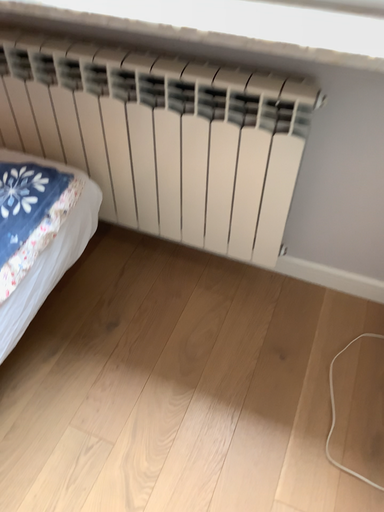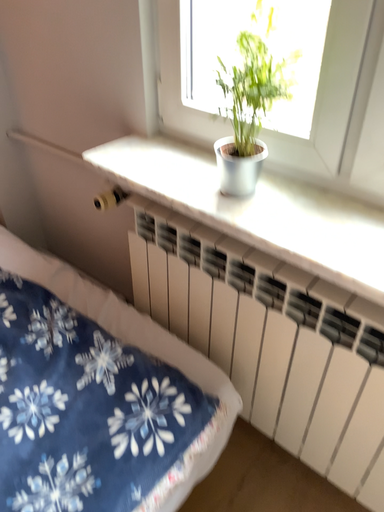
Question: Which way did the camera rotate in the video?

Choices:
 (A) rotated downward
 (B) rotated upward

Answer: (B)